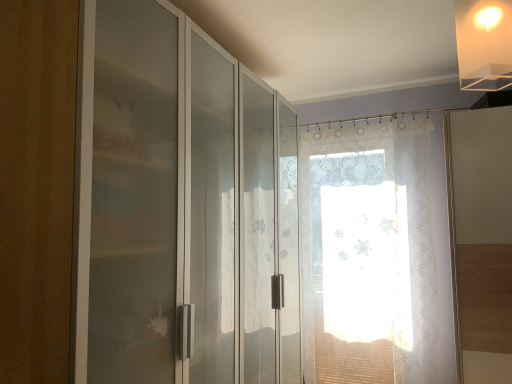
Question: From the image's perspective, is translucent floral curtain at center beneath frosted glass cabinet at left?

Choices:
 (A) no
 (B) yes

Answer: (B)

Question: Is translucent floral curtain at center looking in the opposite direction of frosted glass cabinet at left?

Choices:
 (A) no
 (B) yes

Answer: (A)

Question: Does translucent floral curtain at center touch frosted glass cabinet at left?

Choices:
 (A) no
 (B) yes

Answer: (A)

Question: Is translucent floral curtain at center surrounding frosted glass cabinet at left?

Choices:
 (A) yes
 (B) no

Answer: (B)

Question: From a real-world perspective, is translucent floral curtain at center located beneath frosted glass cabinet at left?

Choices:
 (A) yes
 (B) no

Answer: (A)

Question: Is translucent acrylic lampshade at upper right situated inside frosted glass cabinet at left or outside?

Choices:
 (A) inside
 (B) outside

Answer: (B)

Question: In the image, is translucent acrylic lampshade at upper right positioned in front of or behind frosted glass cabinet at left?

Choices:
 (A) front
 (B) behind

Answer: (B)

Question: In terms of width, does translucent acrylic lampshade at upper right look wider or thinner when compared to frosted glass cabinet at left?

Choices:
 (A) wide
 (B) thin

Answer: (B)

Question: From a real-world perspective, is translucent acrylic lampshade at upper right above or below frosted glass cabinet at left?

Choices:
 (A) below
 (B) above

Answer: (B)

Question: Looking at their shapes, would you say translucent floral curtain at center is wider or thinner than frosted glass cabinet at left?

Choices:
 (A) wide
 (B) thin

Answer: (B)

Question: From their relative heights in the image, would you say translucent floral curtain at center is taller or shorter than frosted glass cabinet at left?

Choices:
 (A) short
 (B) tall

Answer: (B)

Question: From the image's perspective, relative to frosted glass cabinet at left, is translucent floral curtain at center above or below?

Choices:
 (A) below
 (B) above

Answer: (A)

Question: Visually, is translucent floral curtain at center positioned to the left or to the right of frosted glass cabinet at left?

Choices:
 (A) left
 (B) right

Answer: (B)

Question: Would you say translucent floral curtain at center is to the left or to the right of translucent acrylic lampshade at upper right in the picture?

Choices:
 (A) left
 (B) right

Answer: (B)

Question: Is point (326, 274) closer or farther from the camera than point (473, 44)?

Choices:
 (A) farther
 (B) closer

Answer: (A)